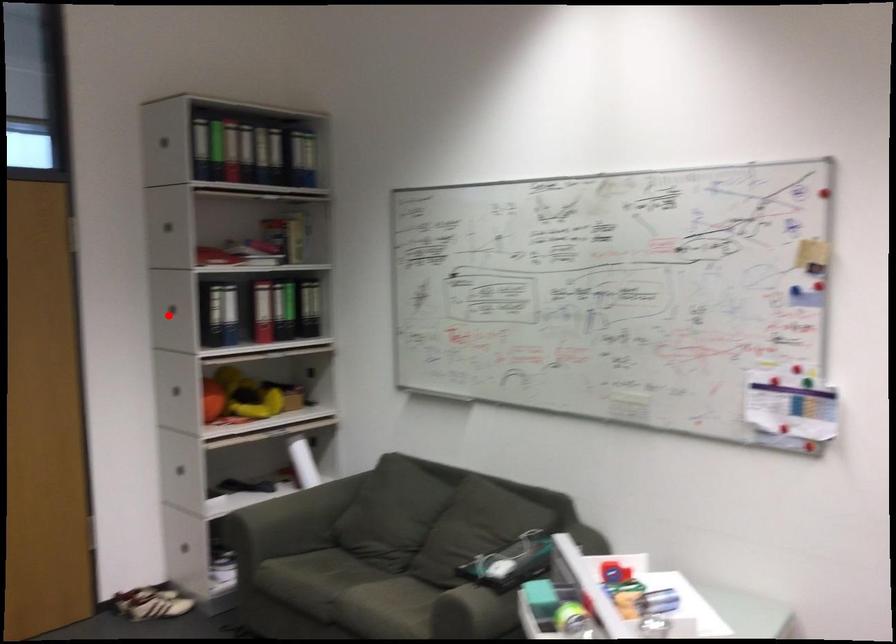
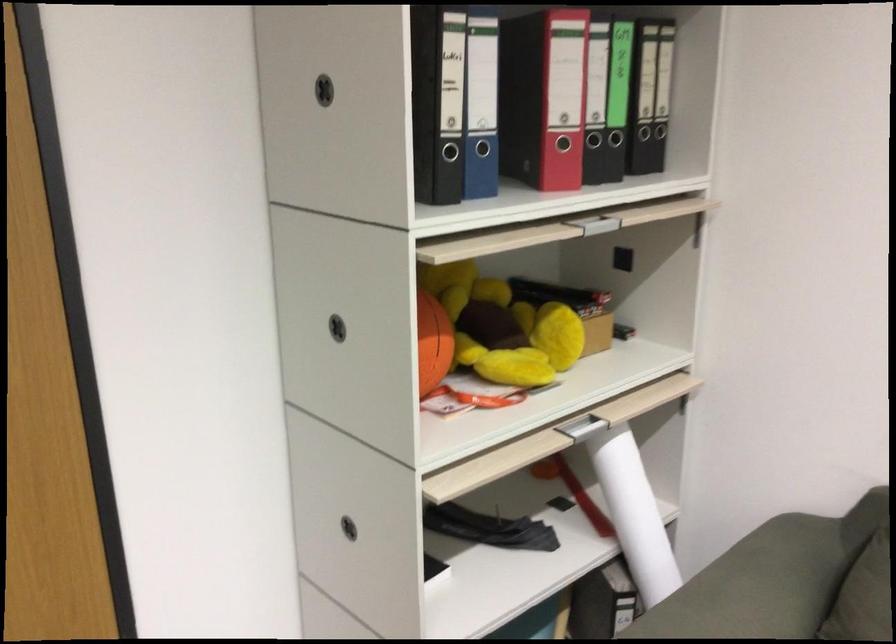
Question: I am providing you with two images of the same scene from different viewpoints. In image1, a red point is highlighted. Considering the same 3D point in image2, which of the following is correct?

Choices:
 (A) It is closer
 (B) It is farther

Answer: (A)